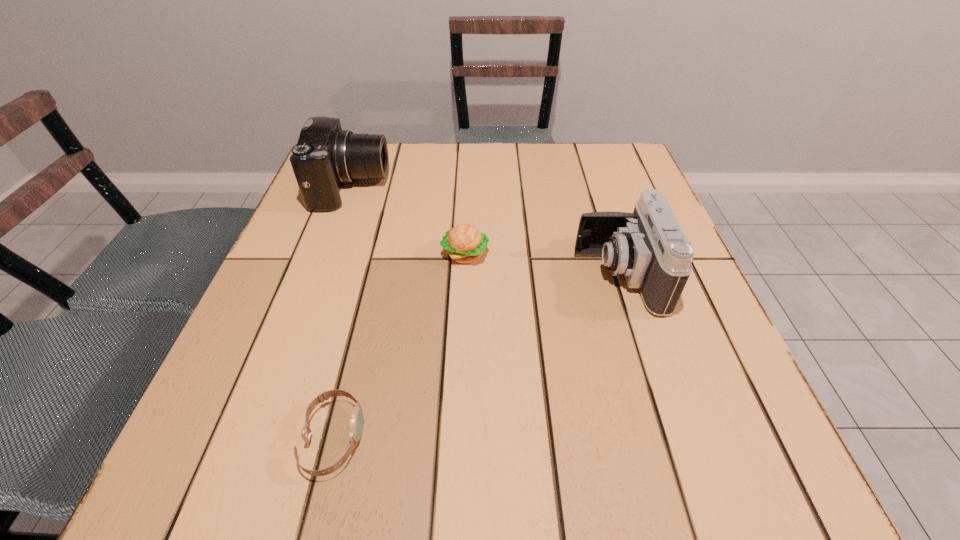
Locate an element on the screen. The image size is (960, 540). vacant region located at the front of the right camera with an open lens cover is located at coordinates (396, 276).

I want to click on vacant space located 0.390m at the front of the right camera with an open lens cover, so click(380, 276).

Identify the location of vacant space situated 0.130m on the right of the third tallest object. The height and width of the screenshot is (540, 960). click(552, 254).

I want to click on free space located 0.050m on the face of the shortest object, so click(396, 438).

Where is `object present at the far edge`? Image resolution: width=960 pixels, height=540 pixels. object present at the far edge is located at coordinates click(x=325, y=157).

I want to click on object at the near edge, so coord(356,418).

What are the coordinates of `camera situated at the left edge` in the screenshot? It's located at (325, 157).

The image size is (960, 540). I want to click on watch at the left edge, so click(x=356, y=418).

Find the location of a particular element. The width and height of the screenshot is (960, 540). object positioned at the right edge is located at coordinates (648, 246).

At what (x,y) coordinates should I click in order to perform the action: click on object that is at the far left corner. Please return your answer as a coordinate pair (x, y). The width and height of the screenshot is (960, 540). Looking at the image, I should click on pos(325,157).